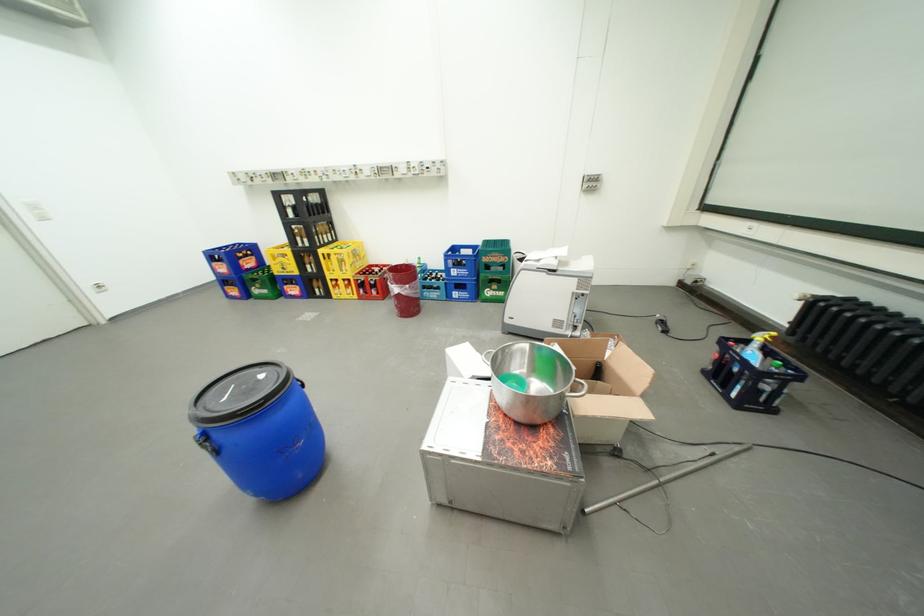
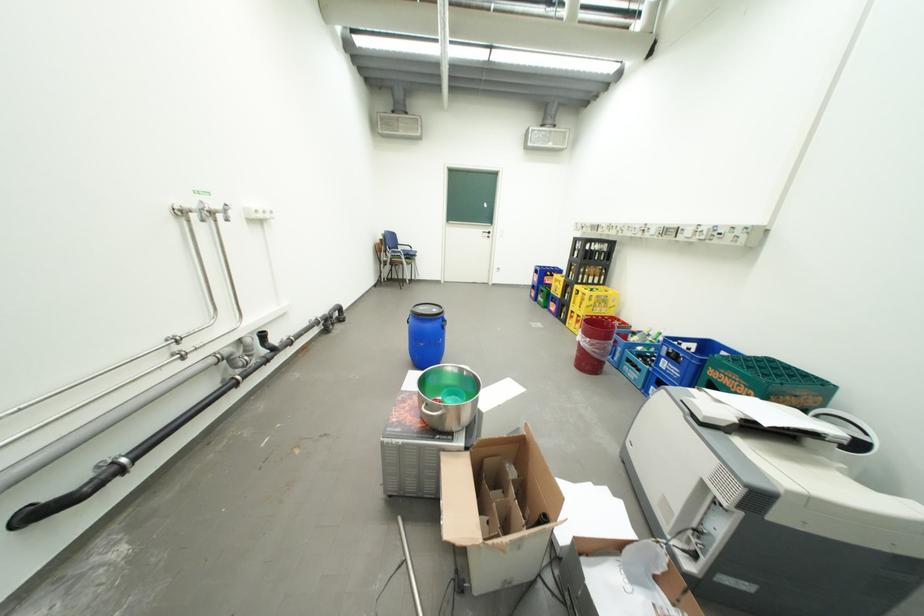
The point at (463, 270) is marked in the first image. Where is the corresponding point in the second image?

(674, 361)